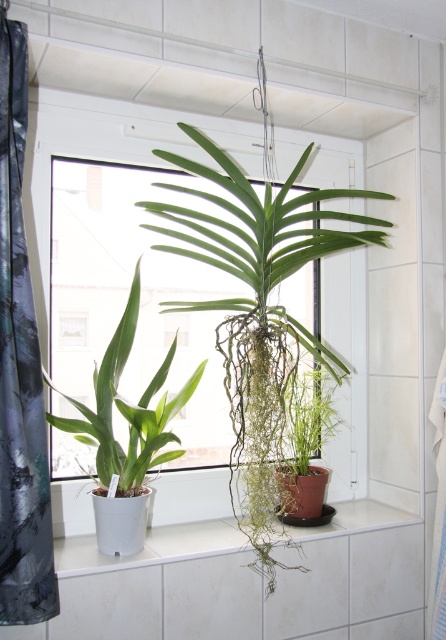
Measure the distance from black matte shower curtain at left to white ceramic window sill at center.

A distance of 44.46 centimeters exists between black matte shower curtain at left and white ceramic window sill at center.

Which is behind, point (8, 150) or point (178, 554)?

Positioned behind is point (178, 554).

Between point (36, 520) and point (181, 556), which one is positioned in front?

Point (36, 520) is more forward.

Identify the location of black matte shower curtain at left. This screenshot has width=446, height=640. (20, 371).

Which of these two, green leafy plant at center or black matte shower curtain at left, stands taller?

green leafy plant at center is taller.

Between green leafy plant at center and black matte shower curtain at left, which one is positioned higher?

green leafy plant at center is higher up.

Locate an element on the screen. This screenshot has width=446, height=640. green leafy plant at center is located at coordinates 140,292.

Which is more to the left, green leafy plant at center or white ceramic window sill at center?

From the viewer's perspective, green leafy plant at center appears more on the left side.

Who is more distant from viewer, (66, 184) or (78, 541)?

Positioned behind is point (66, 184).

Is point (74, 204) farther from viewer compared to point (312, 532)?

Yes.

Locate an element on the screen. The height and width of the screenshot is (640, 446). green leafy plant at center is located at coordinates (140, 292).